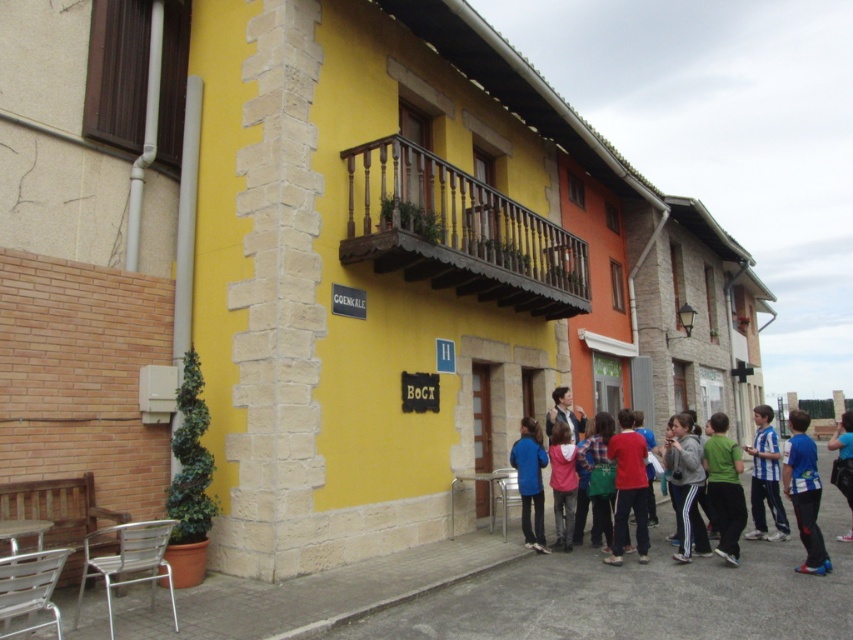
You are a delivery person standing at the entrance of the street. You need to deliver a package to the gray fleece jacket at lower center and the blue fabric jacket at center. If your cart can only carry items within 5 feet of each other, can you deliver both jackets in one trip?

The distance between the gray fleece jacket at lower center and the blue fabric jacket at center is 4.78 feet, which is within the 5 feet limit. Therefore, you can deliver both jackets in one trip.

You are standing at the entrance of the yellow building and see the gray fleece jacket at lower center and a camera. Which object is closer to you?

The gray fleece jacket at lower center is closer to you because it is only 8.46 meters away from the camera, which is farther away.